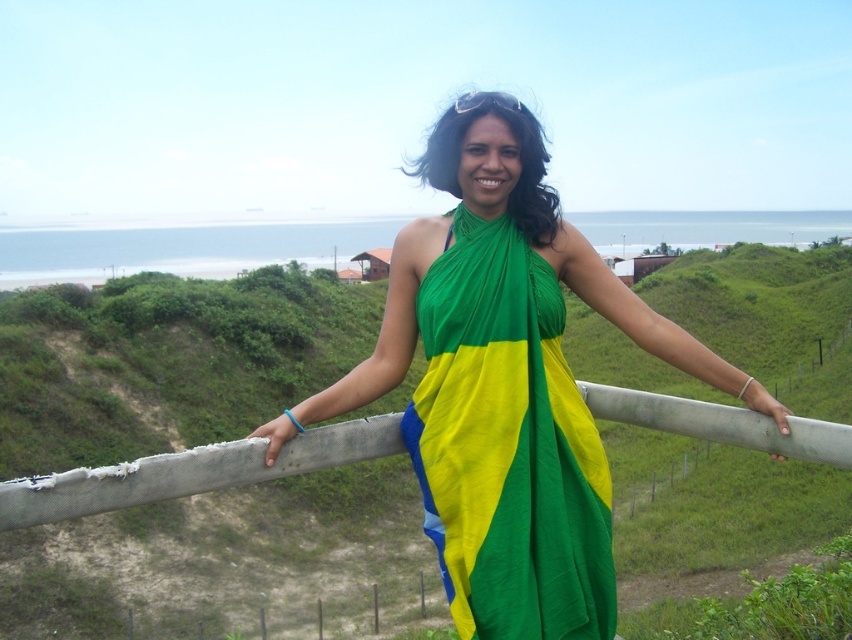
Between green fabric at center and green fabric dress at center, which one is positioned higher?

green fabric at center is above.

From the picture: How much distance is there between green fabric at center and green fabric dress at center?

green fabric at center and green fabric dress at center are 27.85 inches apart.

Where is `green fabric at center`? green fabric at center is located at coordinates (505, 384).